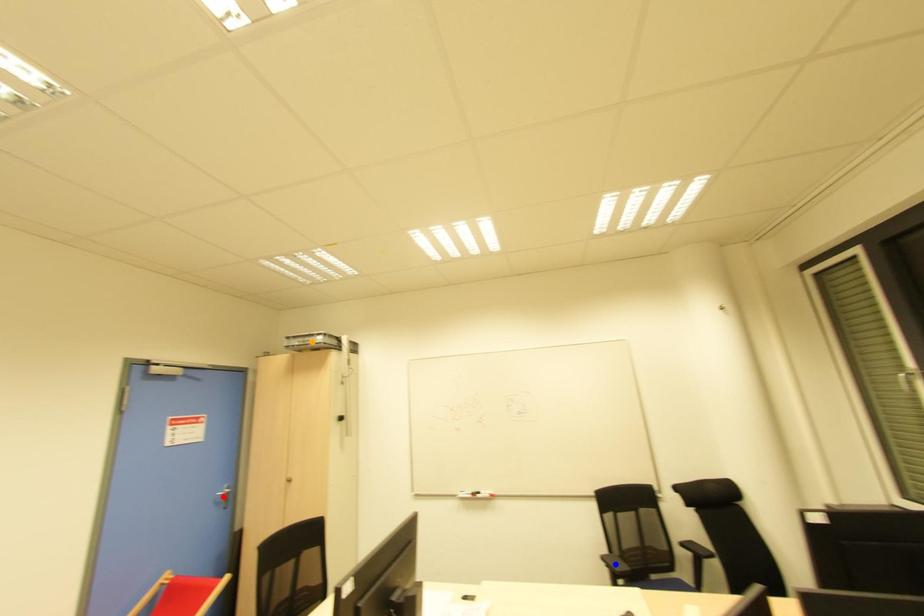
Order these from nearest to farthest:
red point | orange point | blue point

blue point
red point
orange point